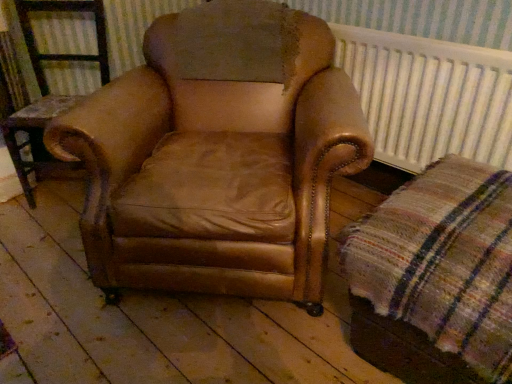
The width and height of the screenshot is (512, 384). What do you see at coordinates (436, 277) in the screenshot?
I see `plaid fabric at lower right` at bounding box center [436, 277].

Image resolution: width=512 pixels, height=384 pixels. What do you see at coordinates (217, 155) in the screenshot? I see `brown leather armchair at center` at bounding box center [217, 155].

In order to click on brown leather armchair at center in this screenshot , I will do `click(45, 85)`.

Which of these two, brown leather armchair at center or white textured radiator at upper right, is smaller?

white textured radiator at upper right is smaller.

Find the location of a particular element. chair below the white textured radiator at upper right (from a real-world perspective) is located at coordinates (217, 155).

From a real-world perspective, is brown leather armchair at center physically located above or below white textured radiator at upper right?

From a real-world perspective, brown leather armchair at center is physically below white textured radiator at upper right.

Considering the sizes of brown leather armchair at center and white textured radiator at upper right in the image, is brown leather armchair at center taller or shorter than white textured radiator at upper right?

Clearly, brown leather armchair at center is taller compared to white textured radiator at upper right.

Is white textured radiator at upper right facing away from brown leather armchair at center?

No, white textured radiator at upper right is not facing away from brown leather armchair at center.

Choose the correct answer: Is white textured radiator at upper right inside brown leather armchair at center or outside it?

white textured radiator at upper right is spatially situated outside brown leather armchair at center.

In the scene shown: Which object is closer to the camera taking this photo, white textured radiator at upper right or brown leather armchair at center?

brown leather armchair at center.

From a real-world perspective, is white textured radiator at upper right under brown leather armchair at center?

No, from a real-world perspective, white textured radiator at upper right is not below brown leather armchair at center.

Can you confirm if brown leather armchair at center is thinner than plaid fabric at lower right?

Yes, brown leather armchair at center is thinner than plaid fabric at lower right.

Is brown leather armchair at center next to plaid fabric at lower right?

No.

The image size is (512, 384). I want to click on plaid that appears on the right of brown leather armchair at center, so click(x=436, y=277).

Considering the sizes of objects brown leather armchair at center and plaid fabric at lower right in the image provided, who is smaller, brown leather armchair at center or plaid fabric at lower right?

With smaller size is brown leather armchair at center.

Is brown leather armchair at center located outside plaid fabric at lower right?

brown leather armchair at center lies outside plaid fabric at lower right's area.

Based on the photo, is brown leather armchair at center oriented away from plaid fabric at lower right?

No, brown leather armchair at center's orientation is not away from plaid fabric at lower right.

Based on the photo, is brown leather armchair at center in front of or behind plaid fabric at lower right in the image?

brown leather armchair at center is positioned farther from the viewer than plaid fabric at lower right.

Can you confirm if plaid fabric at lower right is bigger than white textured radiator at upper right?

Indeed, plaid fabric at lower right has a larger size compared to white textured radiator at upper right.

Does plaid fabric at lower right have a lesser height compared to white textured radiator at upper right?

In fact, plaid fabric at lower right may be taller than white textured radiator at upper right.

Considering the relative positions of plaid fabric at lower right and white textured radiator at upper right in the image provided, is plaid fabric at lower right to the left or to the right of white textured radiator at upper right?

Clearly, plaid fabric at lower right is on the left of white textured radiator at upper right in the image.

Choose the correct answer: Is plaid fabric at lower right inside white textured radiator at upper right or outside it?

plaid fabric at lower right is spatially situated outside white textured radiator at upper right.

Is brown leather armchair at center wider than brown leather armchair at center?

Indeed, brown leather armchair at center has a greater width compared to brown leather armchair at center.

Identify the location of furniture on the left of brown leather armchair at center. Image resolution: width=512 pixels, height=384 pixels. (45, 85).

Which is in front, brown leather armchair at center or brown leather armchair at center?

brown leather armchair at center is in front.

Is brown leather armchair at center facing away from brown leather armchair at center?

No, brown leather armchair at center is not at the back of brown leather armchair at center.

How many degrees apart are the facing directions of brown leather armchair at center and brown leather armchair at center?

5.04 degrees separate the facing orientations of brown leather armchair at center and brown leather armchair at center.

Identify the location of chair that is in front of the brown leather armchair at center. (217, 155).

From a real-world perspective, who is located lower, brown leather armchair at center or brown leather armchair at center?

brown leather armchair at center, from a real-world perspective.

Is brown leather armchair at center touching brown leather armchair at center?

They are not placed beside each other.

At what (x,y) coordinates should I click in order to perform the action: click on chair that is on the left side of white textured radiator at upper right. Please return your answer as a coordinate pair (x, y). Looking at the image, I should click on (217, 155).

At what (x,y) coordinates should I click in order to perform the action: click on radiator on the right of brown leather armchair at center. Please return your answer as a coordinate pair (x, y). This screenshot has width=512, height=384. Looking at the image, I should click on (429, 96).

Looking at this image, considering their positions, is white textured radiator at upper right positioned further to brown leather armchair at center than brown leather armchair at center?

Among the two, white textured radiator at upper right is located further to brown leather armchair at center.

When comparing their distances from brown leather armchair at center, does brown leather armchair at center or white textured radiator at upper right seem further?

white textured radiator at upper right.

From the image, which object appears to be farther from brown leather armchair at center, brown leather armchair at center or plaid fabric at lower right?

Based on the image, brown leather armchair at center appears to be further to brown leather armchair at center.

Which object lies nearer to the anchor point white textured radiator at upper right, plaid fabric at lower right or brown leather armchair at center?

The object closer to white textured radiator at upper right is plaid fabric at lower right.

From the image, which object appears to be farther from brown leather armchair at center, plaid fabric at lower right or white textured radiator at upper right?

Based on the image, plaid fabric at lower right appears to be further to brown leather armchair at center.

Based on their spatial positions, is brown leather armchair at center or white textured radiator at upper right closer to plaid fabric at lower right?

white textured radiator at upper right is closer to plaid fabric at lower right.

When comparing their distances from plaid fabric at lower right, does brown leather armchair at center or white textured radiator at upper right seem further?

Based on the image, white textured radiator at upper right appears to be further to plaid fabric at lower right.

Estimate the real-world distances between objects in this image. Which object is further from brown leather armchair at center, plaid fabric at lower right or white textured radiator at upper right?

white textured radiator at upper right lies further to brown leather armchair at center than the other object.

The width and height of the screenshot is (512, 384). In order to click on plaid between brown leather armchair at center and white textured radiator at upper right in this screenshot , I will do `click(436, 277)`.

Image resolution: width=512 pixels, height=384 pixels. In order to click on plaid situated between brown leather armchair at center and white textured radiator at upper right from left to right in this screenshot , I will do `click(436, 277)`.

Where is `chair between brown leather armchair at center and white textured radiator at upper right`? Image resolution: width=512 pixels, height=384 pixels. chair between brown leather armchair at center and white textured radiator at upper right is located at coordinates (217, 155).

Find the location of a particular element. chair between brown leather armchair at center and plaid fabric at lower right from left to right is located at coordinates (217, 155).